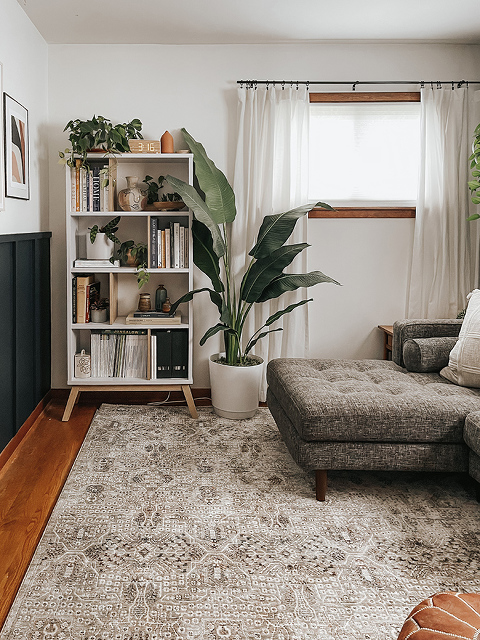
What are the coordinates of `wall` in the screenshot? It's located at (28, 312), (166, 86), (378, 72).